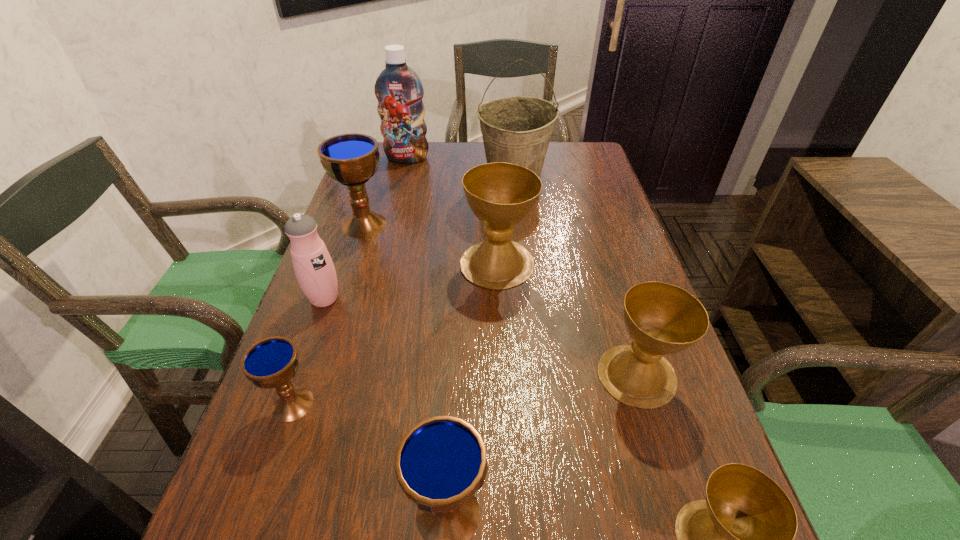
Identify the location of vacant space positioned 0.330m on the front of the leftmost brown chalice. (504, 426).

This screenshot has height=540, width=960. I want to click on free space located 0.080m on the right of the biggest blue chalice, so click(x=421, y=225).

You are a GUI agent. You are given a task and a screenshot of the screen. Output one action in this format:
    pyautogui.click(x=<x>, y=<y>)
    Task: Click on the vacant space located on the front of the thermos bottle
    This screenshot has width=960, height=540.
    Given the screenshot: What is the action you would take?
    pyautogui.click(x=274, y=441)

Find the location of a particular element. free point located on the left of the second nearest brown chalice is located at coordinates (400, 375).

The height and width of the screenshot is (540, 960). What are the coordinates of `vacant space situated on the front of the second farthest blue chalice` in the screenshot? It's located at (271, 467).

This screenshot has width=960, height=540. Find the location of `wine bucket that is at the far edge`. wine bucket that is at the far edge is located at coordinates point(517,130).

This screenshot has width=960, height=540. What are the coordinates of `shampoo at the far edge` in the screenshot? It's located at (398, 89).

Locate an element on the screen. shampoo located at the left edge is located at coordinates (398, 89).

Image resolution: width=960 pixels, height=540 pixels. Find the location of `thermos bottle that is at the left edge`. thermos bottle that is at the left edge is located at coordinates (314, 269).

Where is `wine bucket located at the right edge`? wine bucket located at the right edge is located at coordinates (517, 130).